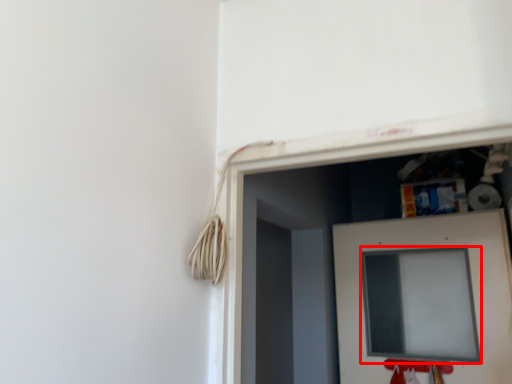
Question: From the image's perspective, considering the relative positions of computer screen (annotated by the red box) and door in the image provided, where is computer screen (annotated by the red box) located with respect to the staircase?

Choices:
 (A) above
 (B) below

Answer: (B)